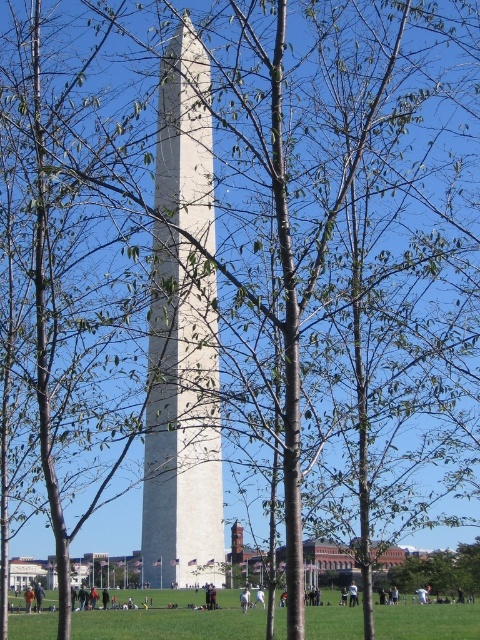
You are standing in the park and want to take a photo of the white marble obelisk at center. However, the green leafy tree at lower right is blocking part of your view. Can you move closer to the obelisk to get a better shot without the tree in the frame?

The white marble obelisk at center is closer to the viewer than the green leafy tree at lower right, so moving closer to the obelisk might not help. To avoid the tree blocking the view, you should move to a position where the tree is no longer between you and the obelisk, perhaps by shifting sideways or going around the tree.